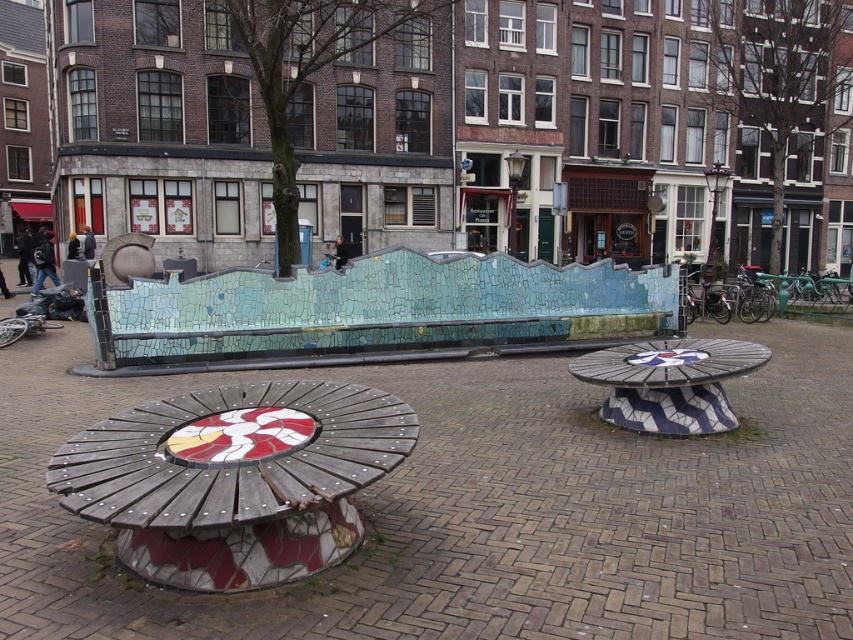
You are standing in the plaza and want to take a photo of the wooden mosaic bench at lower left. If your camera has a maximum focus range of 10 feet, will you be able to capture the bench clearly?

The wooden mosaic bench at lower left is 10.15 feet away from the viewer. Since the camera can only focus up to 10 feet, it won me be able to capture the bench clearly.

You are standing at the center of the plaza. Which direction should you walk to reach the wooden mosaic bench at lower left?

You should walk to the lower left direction to reach the wooden mosaic bench at lower left.

You are standing in the plaza and want to take a photo of the wooden mosaic bench at lower left and the white glossy mosaic table at center. Which object should you focus on first if you want to capture both in a single frame without moving the camera?

You should focus on the wooden mosaic bench at lower left first because it is closer to the viewer than the white glossy mosaic table at center, ensuring both are in focus when using a shallow depth of field.